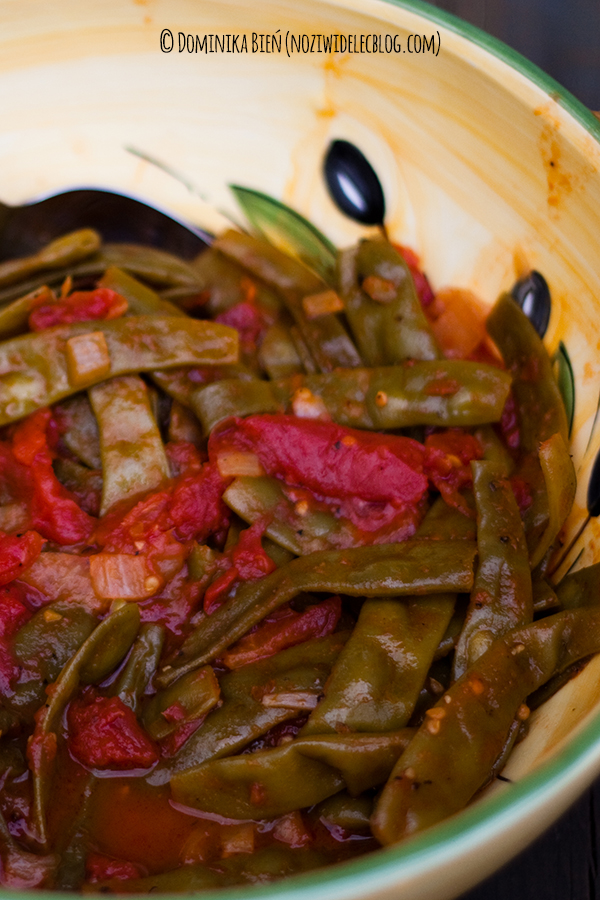
I want to click on bowl design, so click(538, 308), click(360, 186), click(286, 225).